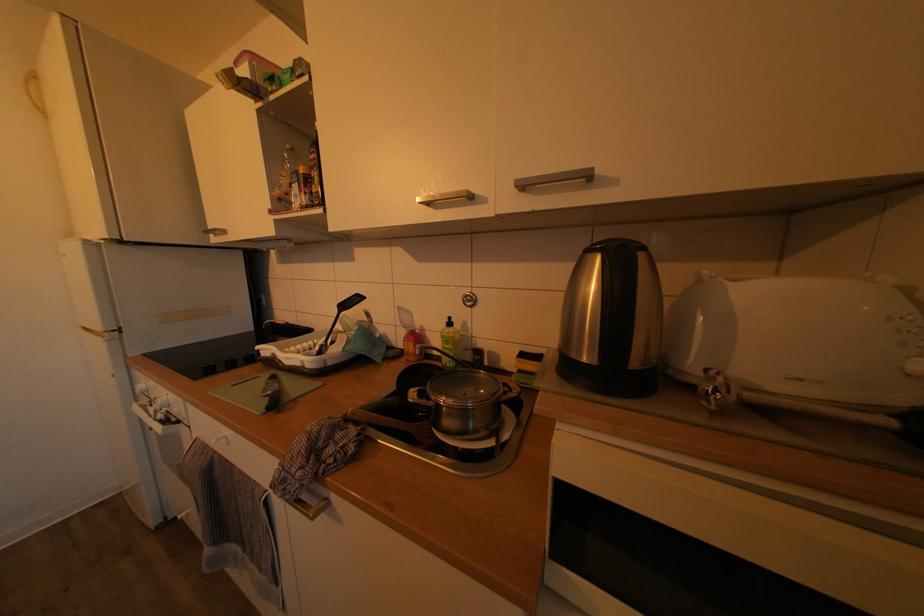
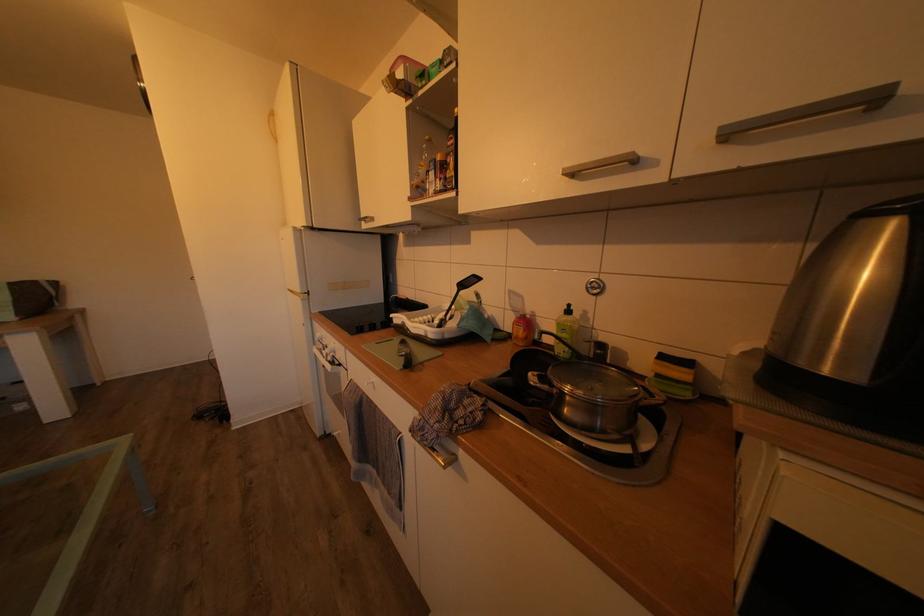
The point at (319, 349) is marked in the first image. Where is the corresponding point in the second image?

(436, 323)